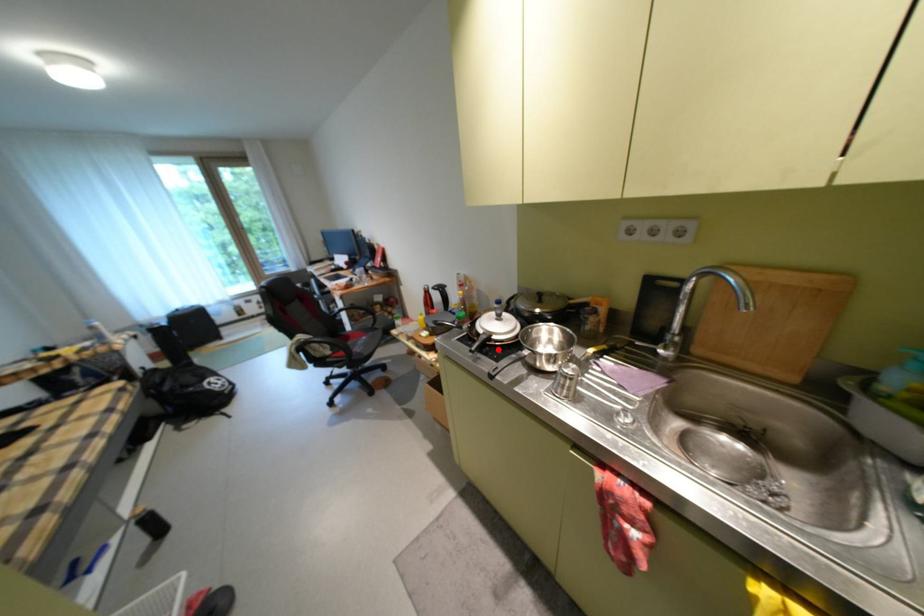
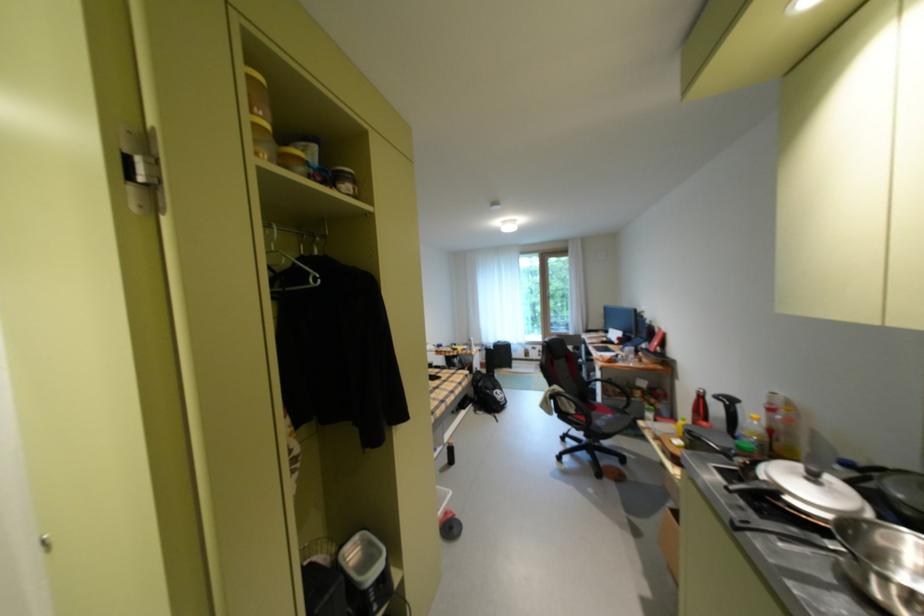
The point at the highlighted location is marked in the first image. Where is the corresponding point in the second image?

(775, 507)